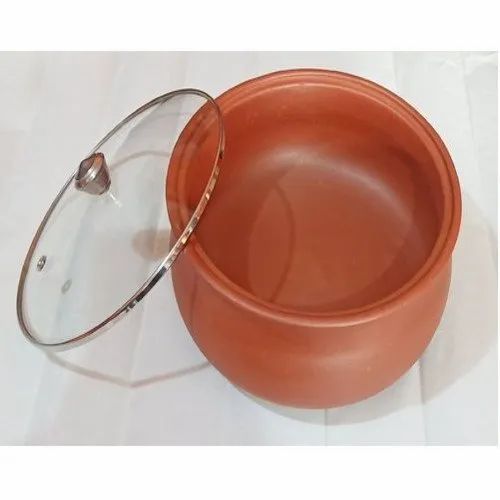
Locate an element on the screen. This screenshot has height=500, width=500. rim around pot is located at coordinates (351, 318).